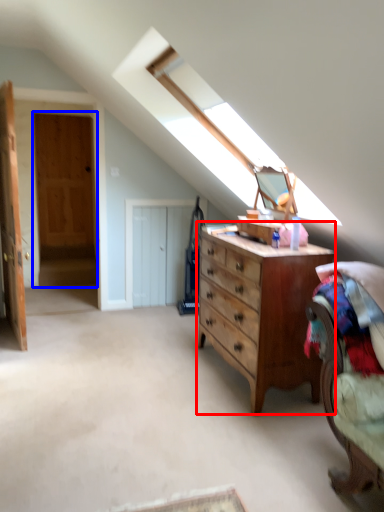
Question: Which object is further to the camera taking this photo, chest of drawers (highlighted by a red box) or door (highlighted by a blue box)?

Choices:
 (A) chest of drawers
 (B) door

Answer: (B)